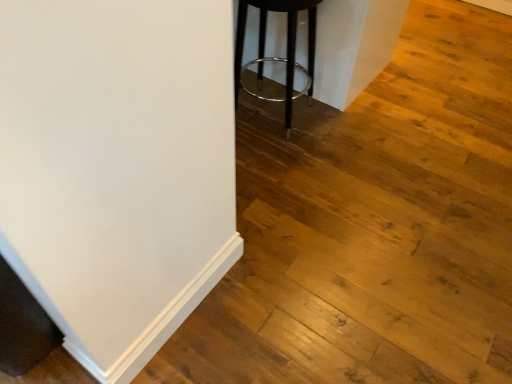
Where is `vacant area that lies to the right of black metal stool at center`? Image resolution: width=512 pixels, height=384 pixels. vacant area that lies to the right of black metal stool at center is located at coordinates (334, 128).